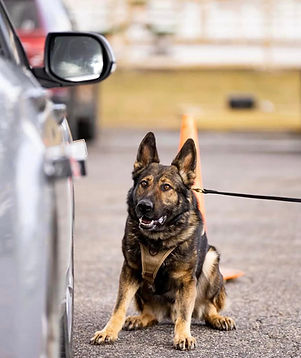
At what (x,y) coordinates should I click in order to perform the action: click on wall. Please return your answer as a coordinate pair (x, y). Image resolution: width=301 pixels, height=358 pixels. Looking at the image, I should click on (154, 99).